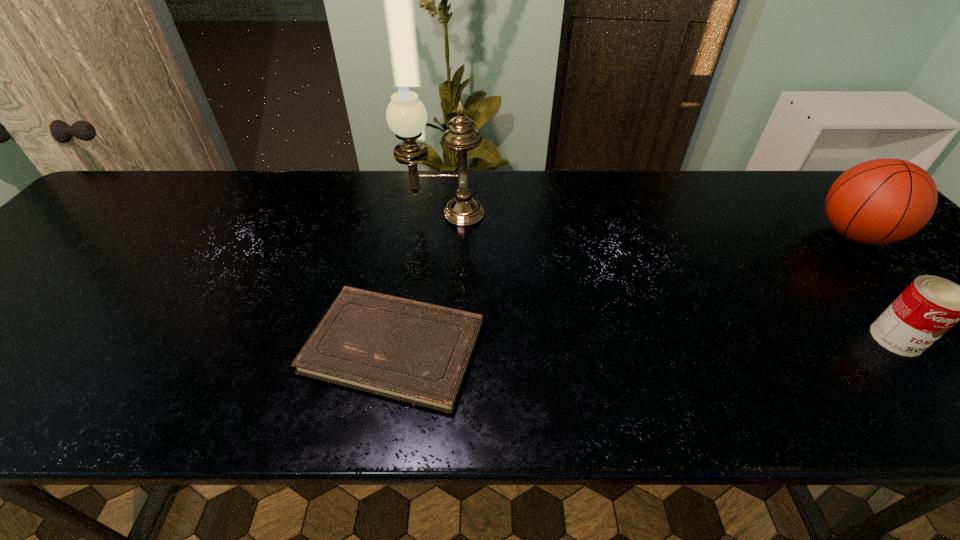
This screenshot has height=540, width=960. Find the location of `vacant space that is in between the paperback book and the basketball`. vacant space that is in between the paperback book and the basketball is located at coordinates (624, 291).

The height and width of the screenshot is (540, 960). I want to click on unoccupied area between the oil lamp and the paperback book, so click(x=419, y=281).

Where is `free area in between the tallest object and the shortest object`? This screenshot has width=960, height=540. free area in between the tallest object and the shortest object is located at coordinates (419, 281).

The height and width of the screenshot is (540, 960). I want to click on unoccupied position between the paperback book and the third shortest object, so click(x=624, y=291).

Where is `vacant point located between the oil lamp and the can`? The width and height of the screenshot is (960, 540). vacant point located between the oil lamp and the can is located at coordinates (669, 276).

What are the coordinates of `vacant space in between the basketball and the third tallest object` in the screenshot? It's located at (875, 287).

Image resolution: width=960 pixels, height=540 pixels. Identify the location of vacant region between the third tallest object and the basketball. (875, 287).

Identify the location of object that stands as the closest to the second shortest object. (880, 201).

Select which object is the second closest to the tallest object. Please provide its 2D coordinates. Your answer should be formatted as a tuple, i.e. [(x, y)], where the tuple contains the x and y coordinates of a point satisfying the conditions above.

[(880, 201)]

Identify the location of vacant space that satisfies the following two spatial constraints: 1. on the back side of the shortest object; 2. on the right side of the second tallest object. The height and width of the screenshot is (540, 960). (413, 235).